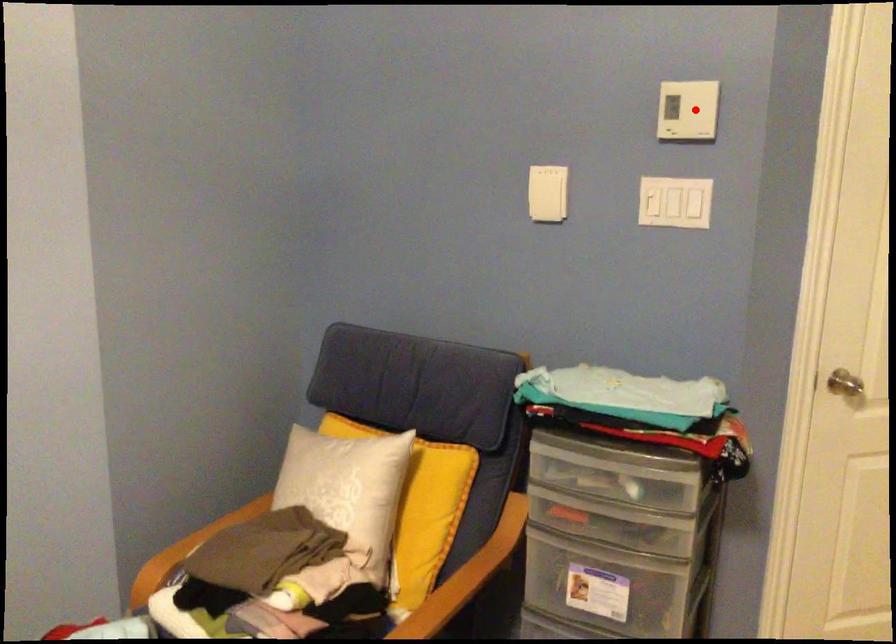
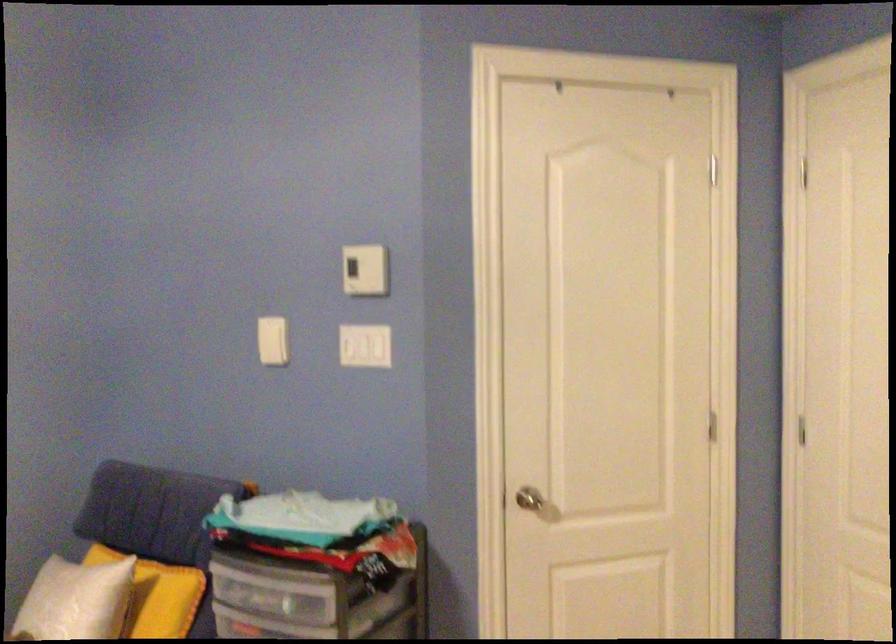
Question: I am providing you with two images of the same scene from different viewpoints. A red point is shown in image1. For the corresponding object point in image2, is it positioned nearer or farther from the camera?

Choices:
 (A) Nearer
 (B) Farther

Answer: (B)